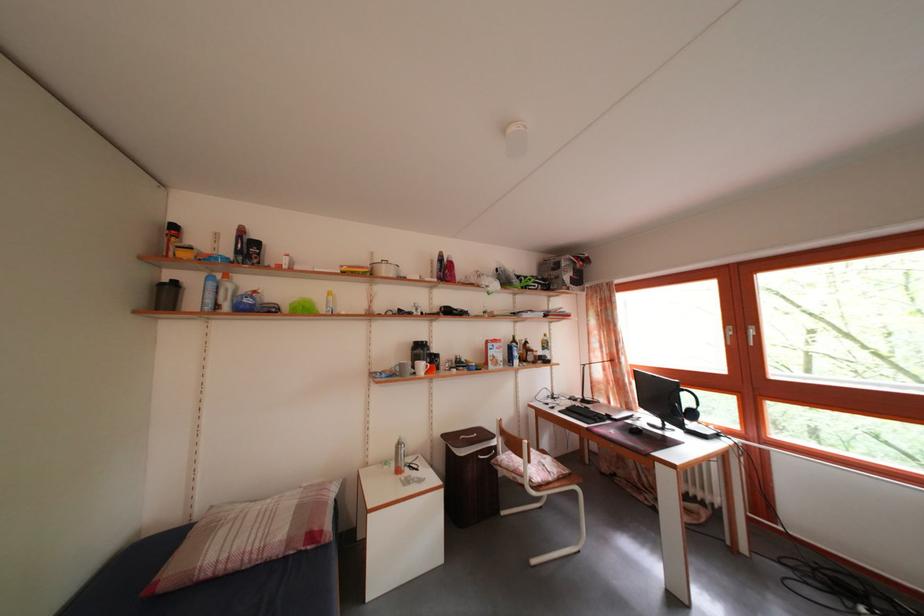
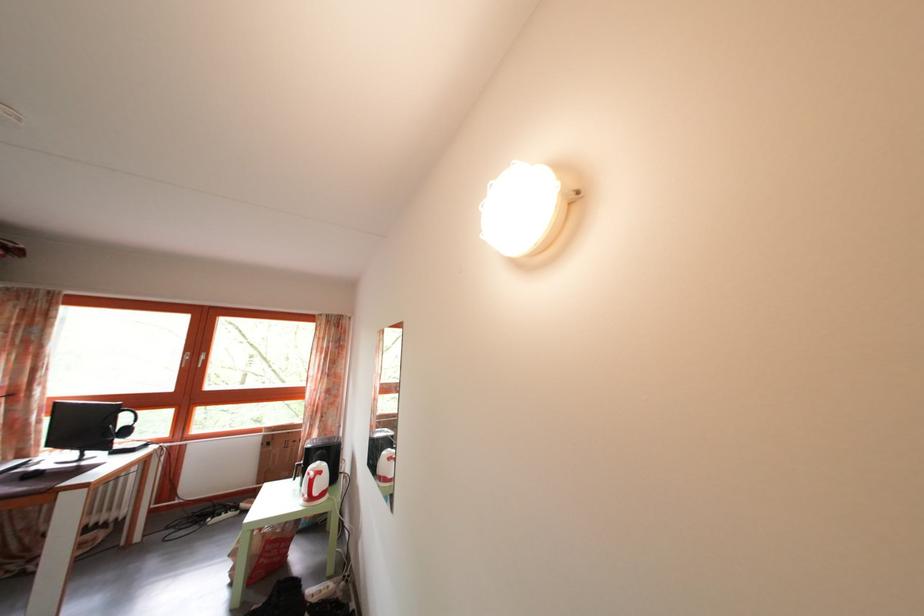
Where in the second image is the point corresponding to point 743,339 from the first image?

(199, 363)